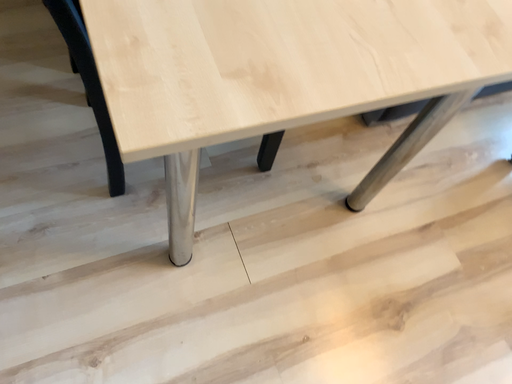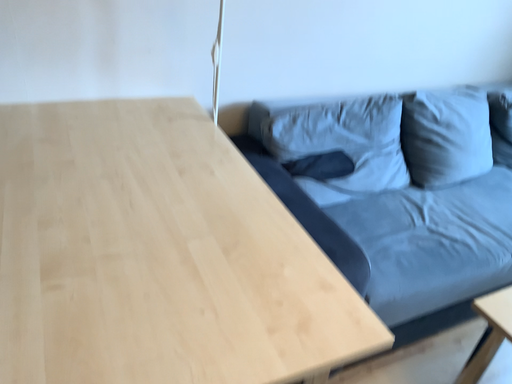
Question: Which way did the camera rotate in the video?

Choices:
 (A) rotated upward
 (B) rotated downward

Answer: (A)